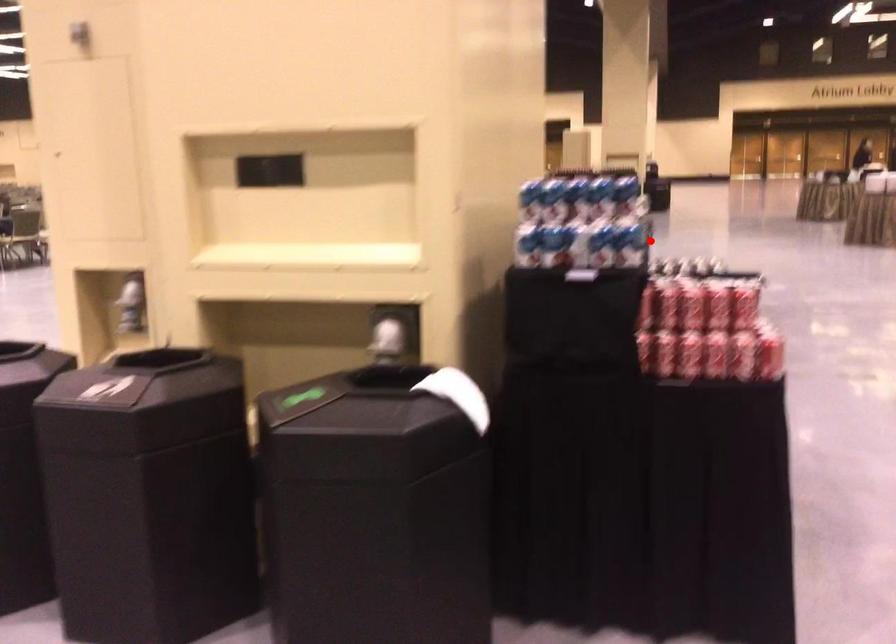
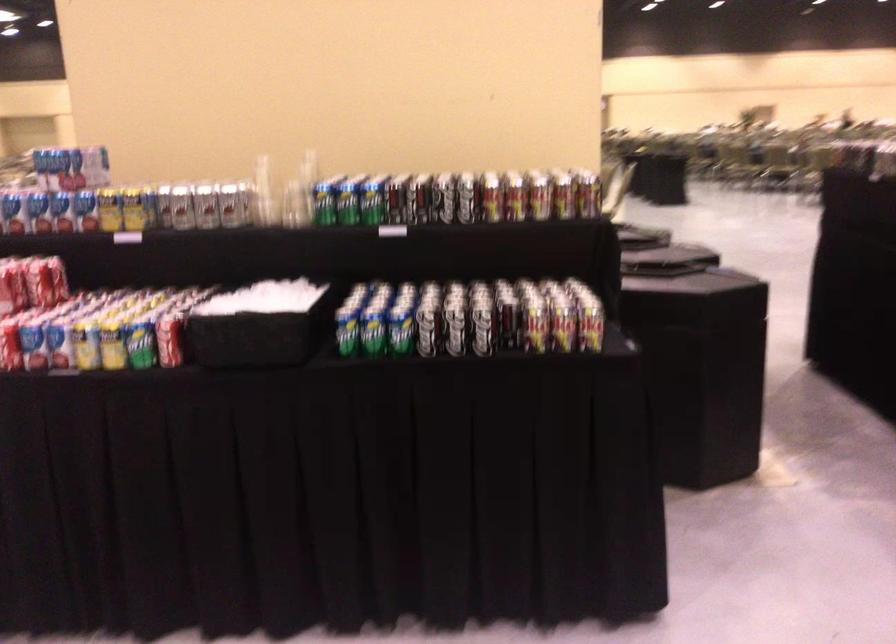
Locate, in the second image, the point that corresponds to the highlighted location in the first image.

(13, 209)